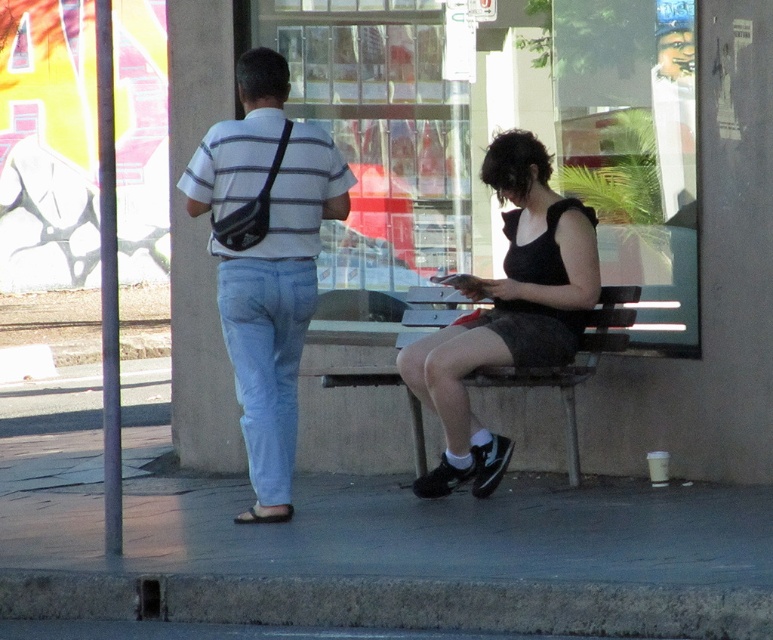
You are a photographer trying to capture a candid shot of both the light blue denim jeans at center and the wooden bench at center. Since you want to include both in the frame, which object should you position closer to the camera to ensure both are visible?

The light blue denim jeans at center is positioned on the left side of wooden bench at center. To include both in the frame, you should position the light blue denim jeans at center closer to the camera so that the wooden bench at center can also be captured without cropping either object.